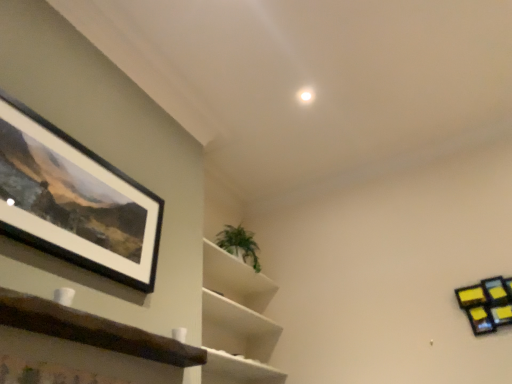
Question: Is black matte picture frame at upper left located outside brown wooden shelf at lower left, marked as the third shelf in a back-to-front arrangement?

Choices:
 (A) yes
 (B) no

Answer: (A)

Question: Considering the relative sizes of black matte picture frame at upper left and brown wooden shelf at lower left, the first shelf viewed from the left, in the image provided, is black matte picture frame at upper left thinner than brown wooden shelf at lower left, the first shelf viewed from the left,?

Choices:
 (A) yes
 (B) no

Answer: (A)

Question: Can you confirm if black matte picture frame at upper left is positioned to the left of brown wooden shelf at lower left, positioned as the 1th shelf in front-to-back order?

Choices:
 (A) no
 (B) yes

Answer: (B)

Question: Could you tell me if black matte picture frame at upper left is turned towards brown wooden shelf at lower left, the first shelf viewed from the left?

Choices:
 (A) yes
 (B) no

Answer: (B)

Question: Does black matte picture frame at upper left appear on the right side of brown wooden shelf at lower left, the first shelf viewed from the left?

Choices:
 (A) yes
 (B) no

Answer: (B)

Question: Does black matte picture frame at upper left contain brown wooden shelf at lower left, positioned as the 1th shelf in front-to-back order?

Choices:
 (A) yes
 (B) no

Answer: (B)

Question: Does green leafy plant at center, the second shelf positioned from the left, have a greater width compared to black matte picture frame at upper left?

Choices:
 (A) no
 (B) yes

Answer: (B)

Question: Is green leafy plant at center, the second shelf positioned from the left, smaller than black matte picture frame at upper left?

Choices:
 (A) yes
 (B) no

Answer: (B)

Question: Can you confirm if green leafy plant at center, positioned as the 2th shelf in front-to-back order, is positioned to the left of black matte picture frame at upper left?

Choices:
 (A) yes
 (B) no

Answer: (B)

Question: Is green leafy plant at center, positioned as the 2th shelf in front-to-back order, to the right of black matte picture frame at upper left from the viewer's perspective?

Choices:
 (A) yes
 (B) no

Answer: (A)

Question: Does green leafy plant at center, marked as the second shelf in a right-to-left arrangement, have a greater height compared to black matte picture frame at upper left?

Choices:
 (A) no
 (B) yes

Answer: (B)

Question: Is there a large distance between green leafy plant at center, marked as the second shelf in a right-to-left arrangement, and black matte picture frame at upper left?

Choices:
 (A) no
 (B) yes

Answer: (B)

Question: Is the position of green leafy plant at upper center more distant than that of yellow sticky notes at upper right, the first shelf from the right?

Choices:
 (A) no
 (B) yes

Answer: (B)